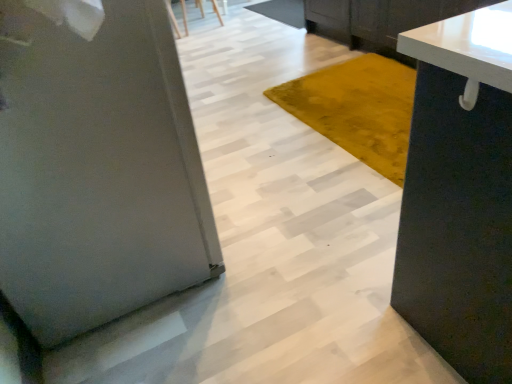
Question: Considering the positions of point (480, 193) and point (17, 309), is point (480, 193) closer or farther from the camera than point (17, 309)?

Choices:
 (A) farther
 (B) closer

Answer: (B)

Question: Looking at their shapes, would you say matte black cabinet at right is wider or thinner than satin silver refrigerator at left?

Choices:
 (A) thin
 (B) wide

Answer: (A)

Question: Which object is positioned farthest from the wooden chair at upper center?

Choices:
 (A) white glossy countertop at upper right
 (B) matte black cabinet at right
 (C) satin silver refrigerator at left

Answer: (B)

Question: Estimate the real-world distances between objects in this image. Which object is farther from the satin silver refrigerator at left?

Choices:
 (A) wooden chair at upper center
 (B) matte black cabinet at right
 (C) white glossy countertop at upper right

Answer: (A)